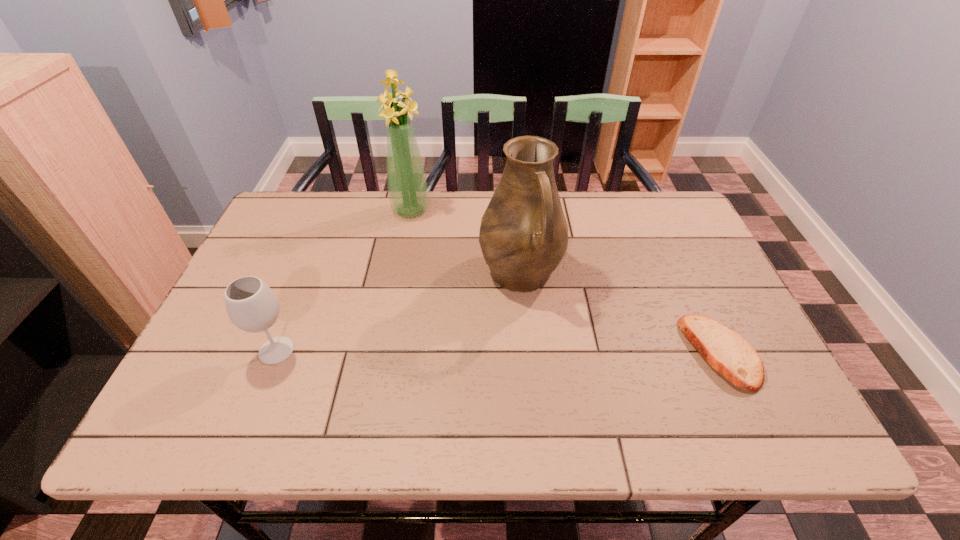
Find the location of a particular element. This screenshot has height=540, width=960. unoccupied position between the farthest object and the second farthest object is located at coordinates tap(466, 242).

The image size is (960, 540). Identify the location of free point between the leftmost object and the farthest object. (344, 281).

You are a GUI agent. You are given a task and a screenshot of the screen. Output one action in this format:
    pyautogui.click(x=<x>, y=<y>)
    Task: Click on the empty space that is in between the rightmost object and the second shortest object
    
    Given the screenshot: What is the action you would take?
    pyautogui.click(x=498, y=352)

Where is `empty space that is in between the pita bread and the leftmost object`? The width and height of the screenshot is (960, 540). empty space that is in between the pita bread and the leftmost object is located at coordinates (498, 352).

Locate an element on the screen. This screenshot has width=960, height=540. free space between the third tallest object and the third nearest object is located at coordinates (398, 312).

In order to click on free space that is in between the third object from right to left and the second object from right to left in this screenshot , I will do `click(466, 242)`.

Find the location of a particular element. vacant region between the bouquet and the leftmost object is located at coordinates (344, 281).

Where is `free point between the leftmost object and the bouquet`? The width and height of the screenshot is (960, 540). free point between the leftmost object and the bouquet is located at coordinates (344, 281).

Find the location of a particular element. This screenshot has width=960, height=540. object that stands as the second closest to the leftmost object is located at coordinates (408, 192).

This screenshot has height=540, width=960. What are the coordinates of `object that ranks as the third closest to the third shortest object` in the screenshot? It's located at (252, 306).